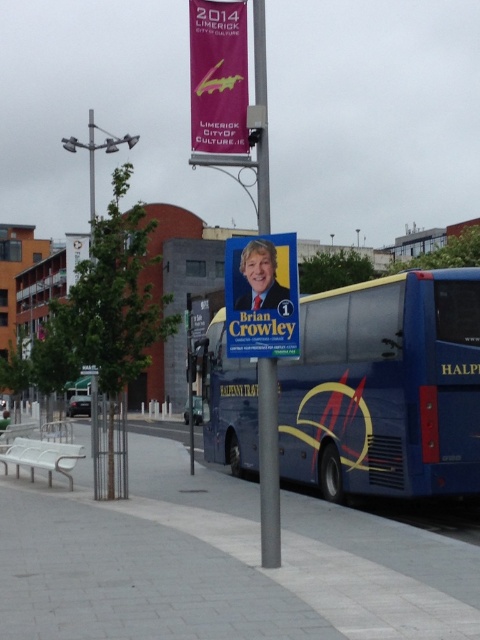
You are a delivery person holding a package that needs to be placed on the gray concrete pavement at center. The blue metallic bus at center is blocking your path. Can you walk around the bus to reach the pavement?

The distance between the gray concrete pavement at center and the blue metallic bus at center is 5.86 feet. Since the bus is blocking the direct path, you would need to walk around it. However, the narrow distance may make it difficult to maneuver around the bus safely without stepping off the sidewalk or into the street.

You are a pedestrian standing on the sidewalk and want to read the text on the matte blue poster at center. The blue metallic bus at center is blocking your view. Can you walk around the bus to see the poster clearly?

The blue metallic bus at center is positioned under the matte blue poster at center, so the bus is below the poster. Since the poster is above the bus, you can see the matte blue poster at center without needing to move around the bus.